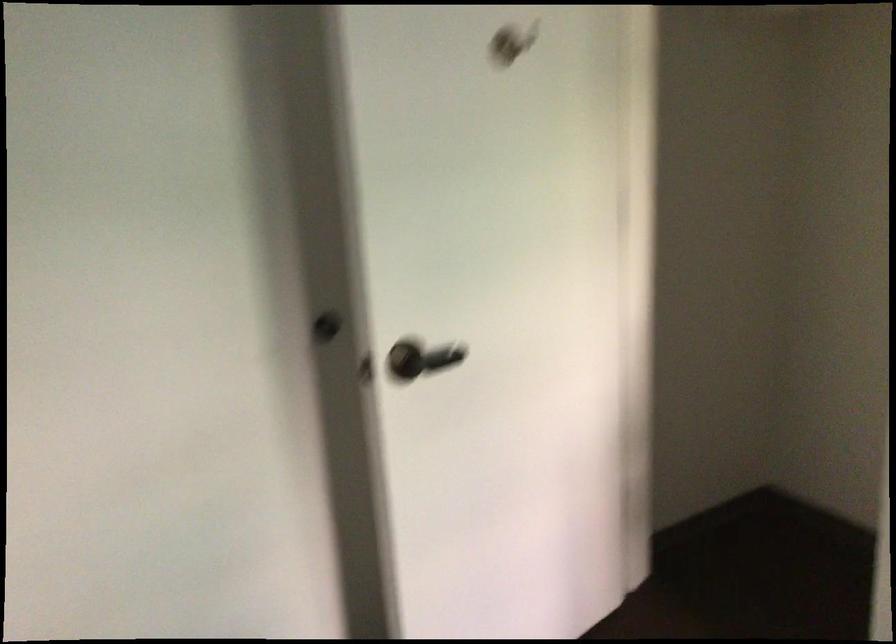
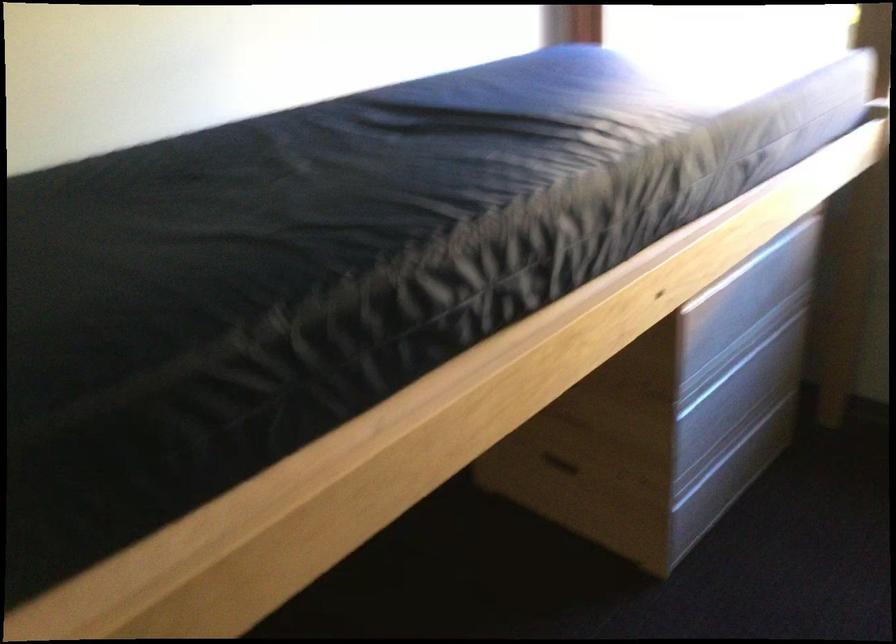
First-person continuous shooting, in which direction is the camera rotating?

The rotation direction of the camera is right-down.